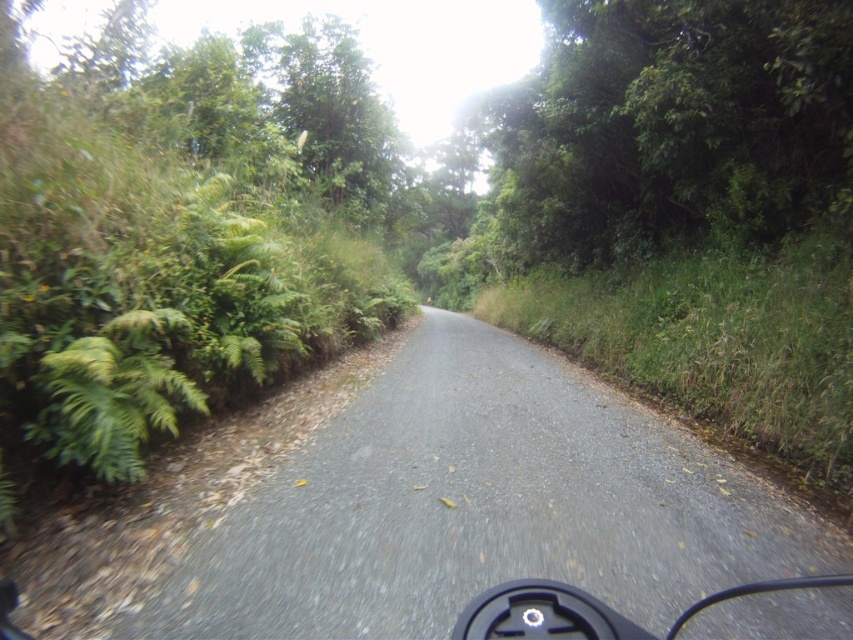
Question: Is gray asphalt road at center thinner than green leafy tree at upper center?

Choices:
 (A) yes
 (B) no

Answer: (B)

Question: Which point is closer to the camera?

Choices:
 (A) gray asphalt road at center
 (B) green leafy tree at upper center

Answer: (A)

Question: Does gray asphalt road at center appear on the right side of green leafy tree at upper center?

Choices:
 (A) yes
 (B) no

Answer: (B)

Question: Does gray asphalt road at center lie behind green leafy tree at upper center?

Choices:
 (A) yes
 (B) no

Answer: (B)